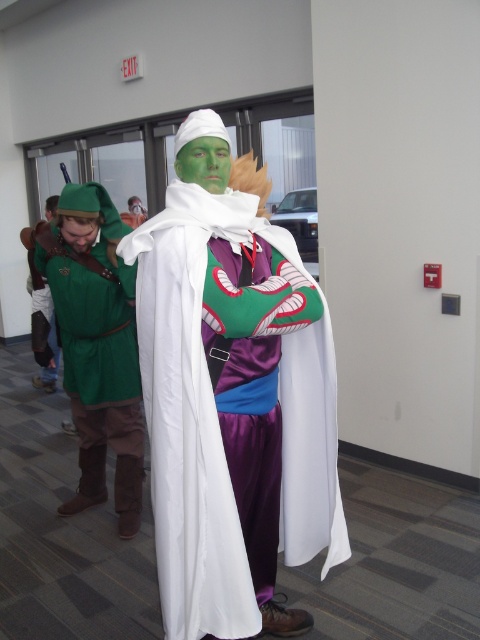
You are a photographer trying to focus on the two points in the image. Which point, point (189, 588) or point (124, 276), is closer to you?

Point (189, 588) is closer to the viewer than point (124, 276).